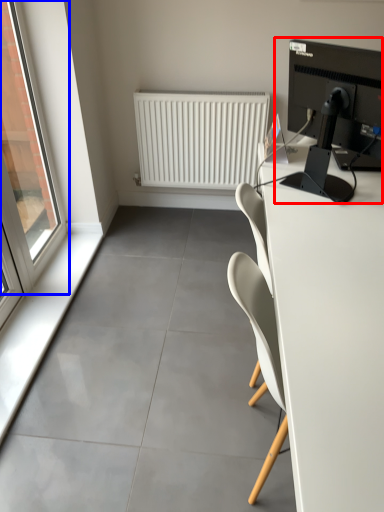
Question: Which of the following is the farthest to the observer, desktop computer (highlighted by a red box) or window (highlighted by a blue box)?

Choices:
 (A) desktop computer
 (B) window

Answer: (B)